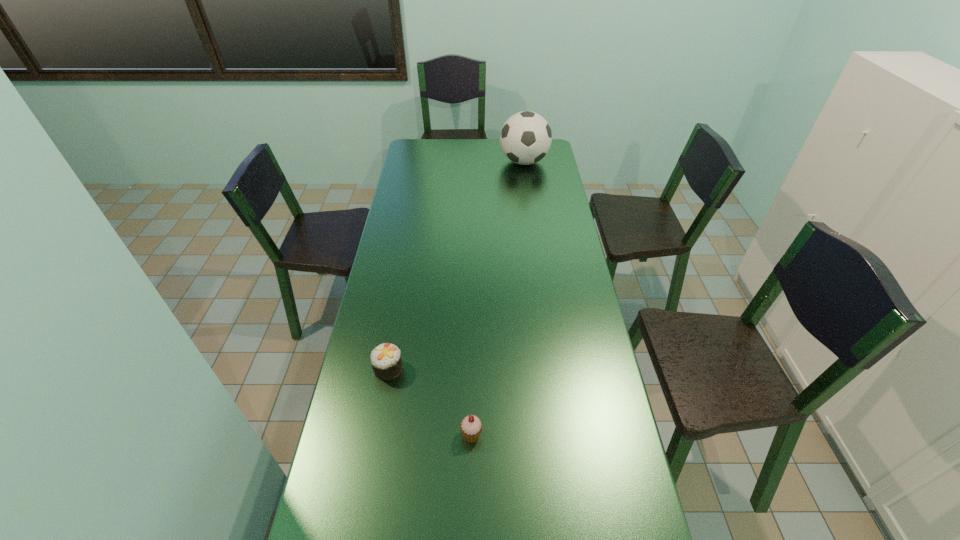
Identify the location of object located in the left edge section of the desktop. (386, 362).

You are a GUI agent. You are given a task and a screenshot of the screen. Output one action in this format:
    pyautogui.click(x=<x>, y=<y>)
    Task: Click on the object that is at the right edge
    The width and height of the screenshot is (960, 540).
    Given the screenshot: What is the action you would take?
    pyautogui.click(x=525, y=138)

Find the location of a particular element. The image size is (960, 540). object present at the far right corner is located at coordinates (525, 138).

This screenshot has height=540, width=960. In the image, there is a desktop. Find the location of `free space at the left edge`. free space at the left edge is located at coordinates (386, 280).

Locate an element on the screen. Image resolution: width=960 pixels, height=540 pixels. free space at the right edge is located at coordinates (616, 524).

This screenshot has height=540, width=960. In the image, there is a desktop. In order to click on vacant space at the far right corner in this screenshot , I will do `click(552, 148)`.

Where is `vacant space in between the tallest object and the nearer cupcake`? The image size is (960, 540). vacant space in between the tallest object and the nearer cupcake is located at coordinates tap(497, 298).

Locate an element on the screen. empty space that is in between the second farthest object and the right cupcake is located at coordinates (430, 402).

Locate an element on the screen. The height and width of the screenshot is (540, 960). empty location between the nearer cupcake and the second nearest object is located at coordinates (430, 402).

This screenshot has height=540, width=960. What are the coordinates of `free space that is in between the soccer ball and the left cupcake` in the screenshot? It's located at (456, 265).